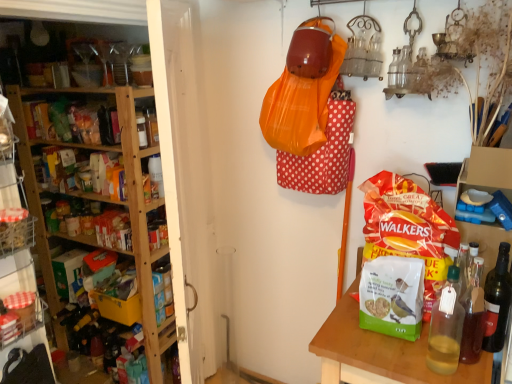
Question: Considering the relative sizes of matte red bag of chips at right and translucent glass bottle at right, marked as the 1th bottle in a left-to-right arrangement, in the image provided, is matte red bag of chips at right shorter than translucent glass bottle at right, marked as the 1th bottle in a left-to-right arrangement,?

Choices:
 (A) yes
 (B) no

Answer: (B)

Question: Would you consider matte red bag of chips at right to be distant from translucent glass bottle at right, marked as the 1th bottle in a left-to-right arrangement?

Choices:
 (A) no
 (B) yes

Answer: (A)

Question: From a real-world perspective, is matte red bag of chips at right located beneath translucent glass bottle at right, which is the second bottle in right-to-left order?

Choices:
 (A) yes
 (B) no

Answer: (B)

Question: Does matte red bag of chips at right touch translucent glass bottle at right, marked as the 1th bottle in a left-to-right arrangement?

Choices:
 (A) no
 (B) yes

Answer: (A)

Question: Is matte red bag of chips at right located outside translucent glass bottle at right, marked as the 1th bottle in a left-to-right arrangement?

Choices:
 (A) yes
 (B) no

Answer: (A)

Question: Does matte red bag of chips at right come in front of translucent glass bottle at right, which is the second bottle in right-to-left order?

Choices:
 (A) no
 (B) yes

Answer: (A)

Question: Can you confirm if matte red bag of chips at right is smaller than wooden table at lower right?

Choices:
 (A) yes
 (B) no

Answer: (A)

Question: Can you confirm if matte red bag of chips at right is positioned to the right of wooden table at lower right?

Choices:
 (A) yes
 (B) no

Answer: (B)

Question: Considering the relative sizes of matte red bag of chips at right and wooden table at lower right in the image provided, is matte red bag of chips at right thinner than wooden table at lower right?

Choices:
 (A) no
 (B) yes

Answer: (B)

Question: Is matte red bag of chips at right bigger than wooden table at lower right?

Choices:
 (A) no
 (B) yes

Answer: (A)

Question: Does matte red bag of chips at right have a lesser height compared to wooden table at lower right?

Choices:
 (A) yes
 (B) no

Answer: (A)

Question: Is matte red bag of chips at right further to camera compared to wooden table at lower right?

Choices:
 (A) yes
 (B) no

Answer: (A)

Question: Is the position of translucent glass bottle at right, which is the second bottle in left-to-right order, more distant than that of wooden shelves at left?

Choices:
 (A) yes
 (B) no

Answer: (A)